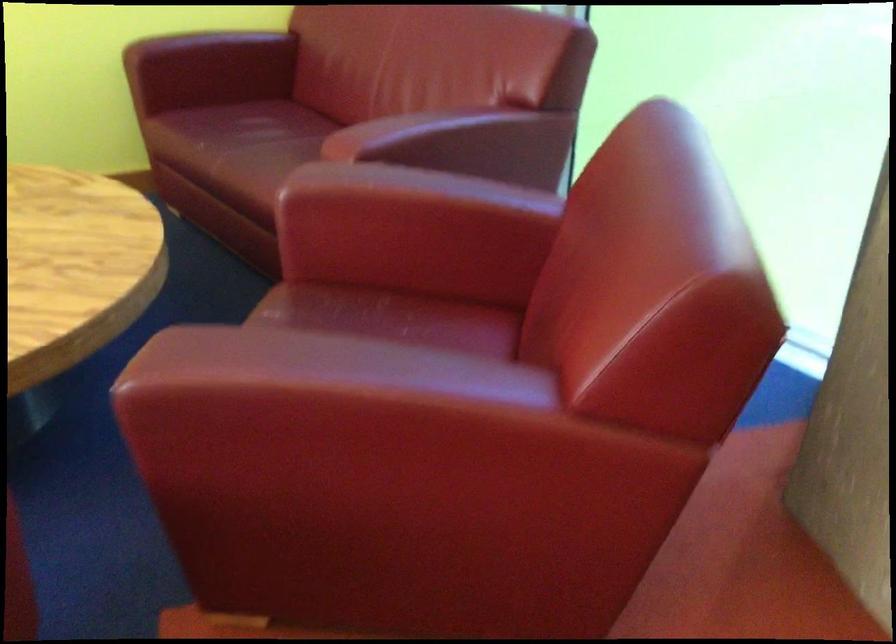
The width and height of the screenshot is (896, 644). Describe the element at coordinates (263, 131) in the screenshot. I see `a red chair sitting surface` at that location.